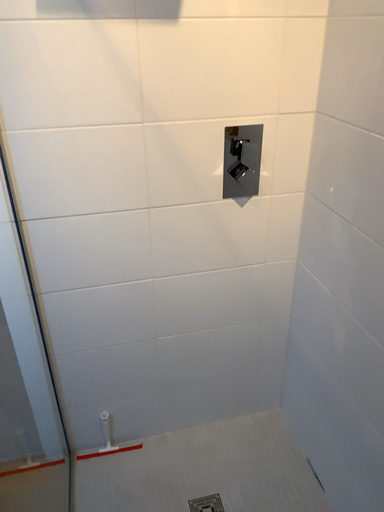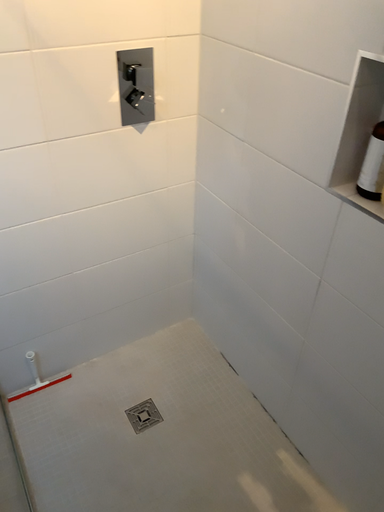
Question: How did the camera likely rotate when shooting the video?

Choices:
 (A) rotated right
 (B) rotated left

Answer: (A)